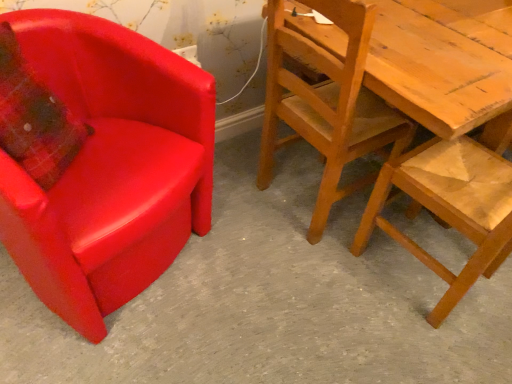
Measure the distance between wooden chair at right, the second chair positioned from the left, and camera.

wooden chair at right, the second chair positioned from the left, and camera are 39.16 inches apart.

Measure the distance between point (198, 79) and camera.

A distance of 1.18 meters exists between point (198, 79) and camera.

What are the coordinates of `wooden textured chair at right, which is the 1th chair from right to left` in the screenshot? It's located at (452, 203).

Is wooden textured chair at right, which ranks as the third chair in left-to-right order, facing towards wooden chair at right, the second chair positioned from the left?

Yes, wooden textured chair at right, which ranks as the third chair in left-to-right order, is turned towards wooden chair at right, the second chair positioned from the left.

Which of these two, wooden textured chair at right, which ranks as the third chair in left-to-right order, or wooden chair at right, positioned as the 2th chair in right-to-left order, is bigger?

wooden chair at right, positioned as the 2th chair in right-to-left order.

Between wooden textured chair at right, which is the 1th chair from right to left, and wooden chair at right, the second chair positioned from the left, which one is positioned in front?

wooden textured chair at right, which is the 1th chair from right to left, is more forward.

Is wooden chair at right, positioned as the 2th chair in right-to-left order, surrounded by wooden textured chair at right, which ranks as the third chair in left-to-right order?

No, wooden chair at right, positioned as the 2th chair in right-to-left order, is not a part of wooden textured chair at right, which ranks as the third chair in left-to-right order.

From the image's perspective, would you say wooden textured chair at right, which is the 1th chair from right to left, is shown under matte plastic chair at left?

No.

Between wooden textured chair at right, which ranks as the third chair in left-to-right order, and matte plastic chair at left, which one appears on the right side from the viewer's perspective?

Positioned to the right is wooden textured chair at right, which ranks as the third chair in left-to-right order.

In terms of height, does wooden textured chair at right, which ranks as the third chair in left-to-right order, look taller or shorter compared to matte plastic chair at left?

Clearly, wooden textured chair at right, which ranks as the third chair in left-to-right order, is taller compared to matte plastic chair at left.

Is wooden textured chair at right, which is the 1th chair from right to left, situated inside matte plastic chair at left or outside?

wooden textured chair at right, which is the 1th chair from right to left, is outside matte plastic chair at left.

How different are the orientations of matte red armchair at left, the third chair when ordered from right to left, and wooden textured chair at right, which is the 1th chair from right to left, in degrees?

The facing directions of matte red armchair at left, the third chair when ordered from right to left, and wooden textured chair at right, which is the 1th chair from right to left, are 160 degrees apart.

From a real-world perspective, is matte red armchair at left, marked as the first chair in a left-to-right arrangement, on wooden textured chair at right, which ranks as the third chair in left-to-right order?

No.

Consider the image. Are matte red armchair at left, the third chair when ordered from right to left, and wooden textured chair at right, which ranks as the third chair in left-to-right order, making contact?

No, matte red armchair at left, the third chair when ordered from right to left, is not in contact with wooden textured chair at right, which ranks as the third chair in left-to-right order.

Is matte red armchair at left, the third chair when ordered from right to left, at the left side of wooden textured chair at right, which ranks as the third chair in left-to-right order?

Yes.

Considering the relative positions of matte red armchair at left, marked as the first chair in a left-to-right arrangement, and wooden chair at right, the second chair positioned from the left, in the image provided, is matte red armchair at left, marked as the first chair in a left-to-right arrangement, to the right of wooden chair at right, the second chair positioned from the left, from the viewer's perspective?

In fact, matte red armchair at left, marked as the first chair in a left-to-right arrangement, is to the left of wooden chair at right, the second chair positioned from the left.

Does matte red armchair at left, marked as the first chair in a left-to-right arrangement, have a greater height compared to wooden chair at right, the second chair positioned from the left?

In fact, matte red armchair at left, marked as the first chair in a left-to-right arrangement, may be shorter than wooden chair at right, the second chair positioned from the left.

From the image's perspective, does matte red armchair at left, marked as the first chair in a left-to-right arrangement, appear higher than wooden chair at right, positioned as the 2th chair in right-to-left order?

Incorrect, from the image's perspective, matte red armchair at left, marked as the first chair in a left-to-right arrangement, is lower than wooden chair at right, positioned as the 2th chair in right-to-left order.

Is wooden chair at right, the second chair positioned from the left, turned away from wooden textured chair at right, which is the 1th chair from right to left?

No, wooden chair at right, the second chair positioned from the left, is not facing the opposite direction of wooden textured chair at right, which is the 1th chair from right to left.

Considering the positions of points (334, 176) and (460, 140), is point (334, 176) farther from camera compared to point (460, 140)?

No, it is in front of (460, 140).

Can you tell me how much wooden chair at right, positioned as the 2th chair in right-to-left order, and wooden textured chair at right, which is the 1th chair from right to left, differ in facing direction?

92.2 degrees separate the facing orientations of wooden chair at right, positioned as the 2th chair in right-to-left order, and wooden textured chair at right, which is the 1th chair from right to left.

In terms of size, does wooden chair at right, the second chair positioned from the left, appear bigger or smaller than wooden textured chair at right, which is the 1th chair from right to left?

Considering their sizes, wooden chair at right, the second chair positioned from the left, takes up more space than wooden textured chair at right, which is the 1th chair from right to left.

Which is more distant, (139, 365) or (82, 163)?

The point (139, 365) is farther from the camera.

Looking at this image, which is in front, matte plastic chair at left or matte red armchair at left, the third chair when ordered from right to left?

matte red armchair at left, the third chair when ordered from right to left, is in front.

Is matte plastic chair at left aimed at matte red armchair at left, marked as the first chair in a left-to-right arrangement?

No, matte plastic chair at left is not facing towards matte red armchair at left, marked as the first chair in a left-to-right arrangement.

This screenshot has height=384, width=512. I want to click on chair that is in front of the matte plastic chair at left, so click(109, 167).

From a real-world perspective, does wooden chair at right, positioned as the 2th chair in right-to-left order, sit lower than matte red armchair at left, the third chair when ordered from right to left?

Actually, wooden chair at right, positioned as the 2th chair in right-to-left order, is physically above matte red armchair at left, the third chair when ordered from right to left, in the real world.

Is point (319, 209) positioned after point (138, 238)?

Yes.

Are wooden chair at right, positioned as the 2th chair in right-to-left order, and matte red armchair at left, marked as the first chair in a left-to-right arrangement, located far from each other?

No.

Locate an element on the screen. The image size is (512, 384). chair behind the wooden textured chair at right, which ranks as the third chair in left-to-right order is located at coordinates (327, 103).

Find the location of a particular element. The image size is (512, 384). concrete located in front of the wooden textured chair at right, which is the 1th chair from right to left is located at coordinates (271, 302).

From the image, which object appears to be nearer to wooden textured chair at right, which is the 1th chair from right to left, wooden chair at right, positioned as the 2th chair in right-to-left order, or matte plastic chair at left?

wooden chair at right, positioned as the 2th chair in right-to-left order, lies closer to wooden textured chair at right, which is the 1th chair from right to left, than the other object.

Based on their spatial positions, is matte plastic chair at left or wooden textured chair at right, which is the 1th chair from right to left, closer to matte red armchair at left, marked as the first chair in a left-to-right arrangement?

Based on the image, matte plastic chair at left appears to be nearer to matte red armchair at left, marked as the first chair in a left-to-right arrangement.

When comparing their distances from matte red armchair at left, the third chair when ordered from right to left, does wooden textured chair at right, which is the 1th chair from right to left, or wooden chair at right, the second chair positioned from the left, seem further?

wooden textured chair at right, which is the 1th chair from right to left, is positioned further to the anchor matte red armchair at left, the third chair when ordered from right to left.

When comparing their distances from wooden chair at right, positioned as the 2th chair in right-to-left order, does matte plastic chair at left or matte red armchair at left, the third chair when ordered from right to left, seem closer?

Based on the image, matte plastic chair at left appears to be nearer to wooden chair at right, positioned as the 2th chair in right-to-left order.

Which object lies further to the anchor point wooden chair at right, the second chair positioned from the left, matte plastic chair at left or wooden textured chair at right, which ranks as the third chair in left-to-right order?

matte plastic chair at left lies further to wooden chair at right, the second chair positioned from the left, than the other object.

Looking at the image, which one is located further to wooden textured chair at right, which is the 1th chair from right to left, matte plastic chair at left or wooden chair at right, the second chair positioned from the left?

matte plastic chair at left lies further to wooden textured chair at right, which is the 1th chair from right to left, than the other object.

Looking at the image, which one is located further to wooden textured chair at right, which is the 1th chair from right to left, wooden chair at right, the second chair positioned from the left, or matte red armchair at left, the third chair when ordered from right to left?

Based on the image, matte red armchair at left, the third chair when ordered from right to left, appears to be further to wooden textured chair at right, which is the 1th chair from right to left.

Which object lies further to the anchor point matte plastic chair at left, wooden textured chair at right, which ranks as the third chair in left-to-right order, or wooden chair at right, positioned as the 2th chair in right-to-left order?

wooden chair at right, positioned as the 2th chair in right-to-left order.

Find the location of a particular element. concrete situated between matte red armchair at left, marked as the first chair in a left-to-right arrangement, and wooden textured chair at right, which is the 1th chair from right to left, from left to right is located at coordinates coord(271,302).

This screenshot has width=512, height=384. In order to click on concrete between matte red armchair at left, marked as the first chair in a left-to-right arrangement, and wooden chair at right, the second chair positioned from the left, in the horizontal direction in this screenshot , I will do `click(271, 302)`.

Where is `chair between matte plastic chair at left and wooden textured chair at right, which ranks as the third chair in left-to-right order`? The width and height of the screenshot is (512, 384). chair between matte plastic chair at left and wooden textured chair at right, which ranks as the third chair in left-to-right order is located at coordinates (327, 103).

Where is `chair situated between matte red armchair at left, the third chair when ordered from right to left, and wooden textured chair at right, which ranks as the third chair in left-to-right order, from left to right`? This screenshot has height=384, width=512. chair situated between matte red armchair at left, the third chair when ordered from right to left, and wooden textured chair at right, which ranks as the third chair in left-to-right order, from left to right is located at coordinates (327, 103).